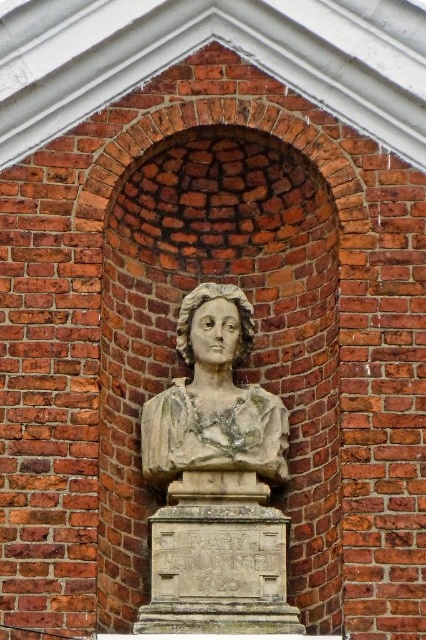
Question: In this image, where is stone bust at center located relative to stone statue at center?

Choices:
 (A) left
 (B) right

Answer: (B)

Question: Among these objects, which one is farthest from the camera?

Choices:
 (A) stone bust at center
 (B) stone statue at center

Answer: (B)

Question: Which object appears farthest from the camera in this image?

Choices:
 (A) stone statue at center
 (B) stone bust at center

Answer: (A)

Question: From the image, what is the correct spatial relationship of stone bust at center in relation to stone statue at center?

Choices:
 (A) right
 (B) left

Answer: (A)

Question: Is stone bust at center to the right of stone statue at center from the viewer's perspective?

Choices:
 (A) yes
 (B) no

Answer: (A)